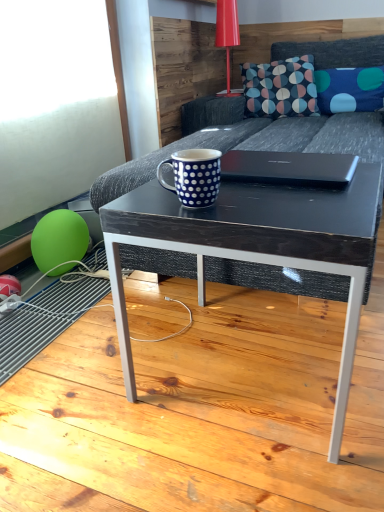
This screenshot has width=384, height=512. Find the location of `empty space that is in between blue dotted mug at center and black matte laptop at center`. empty space that is in between blue dotted mug at center and black matte laptop at center is located at coordinates (264, 191).